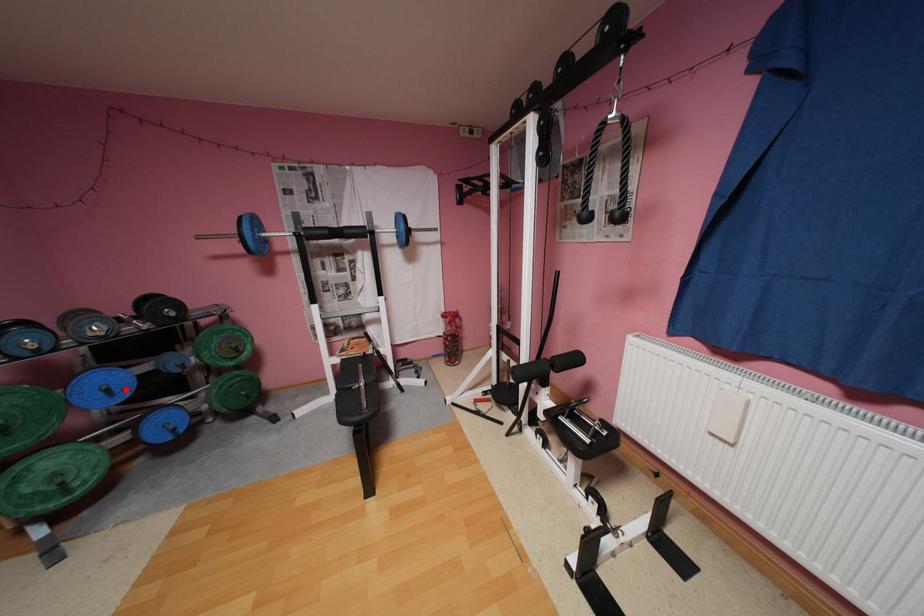
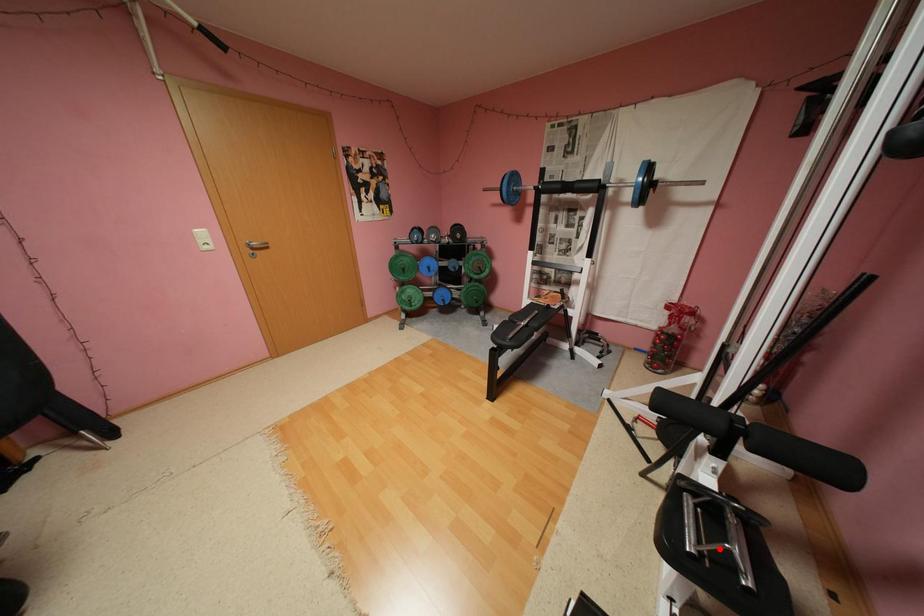
I am providing you with two images of the same scene from different viewpoints. A red point is marked on the first image and another point is marked on the second image. Is the marked point in image1 the same physical position as the marked point in image2?

No